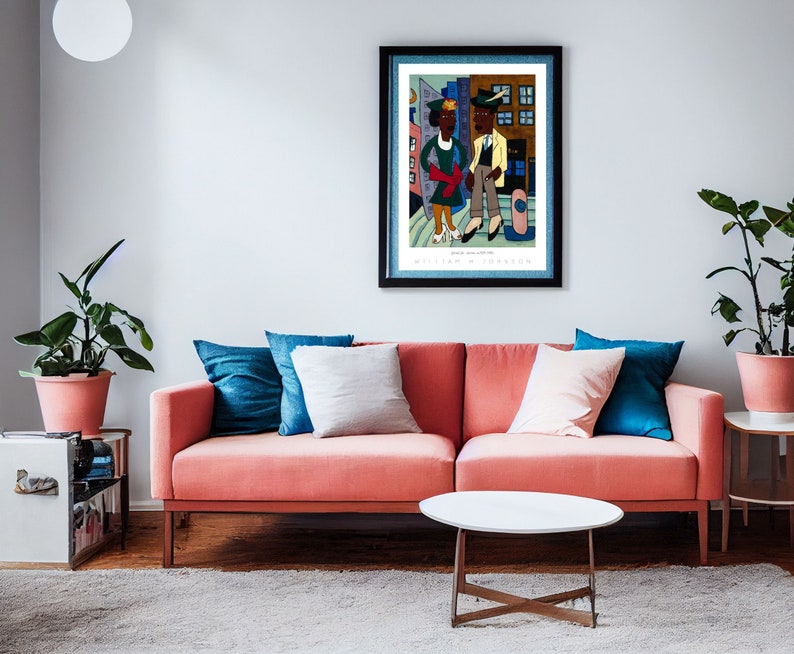
Locate an element on the screen. The image size is (794, 654). blue square pillows is located at coordinates (244, 371), (283, 369), (630, 392).